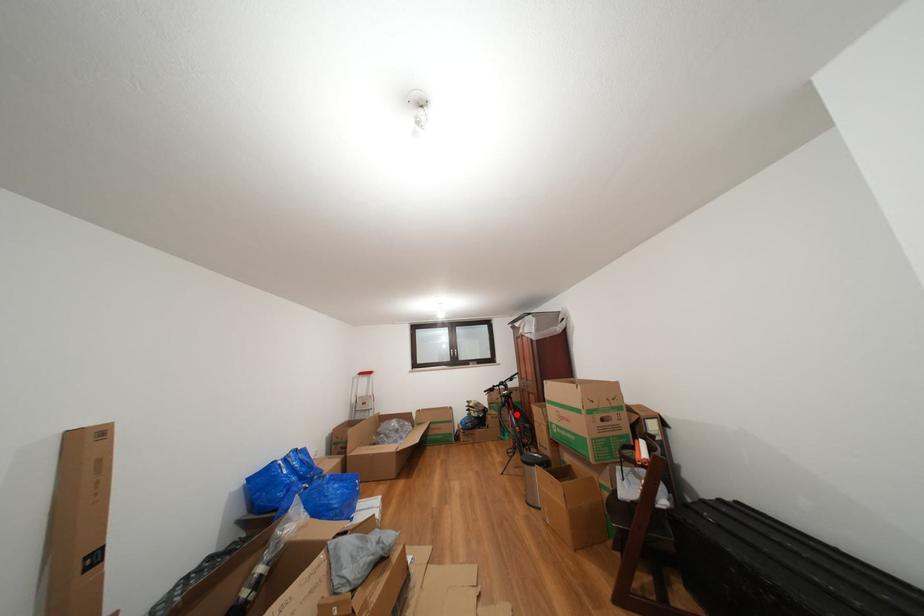
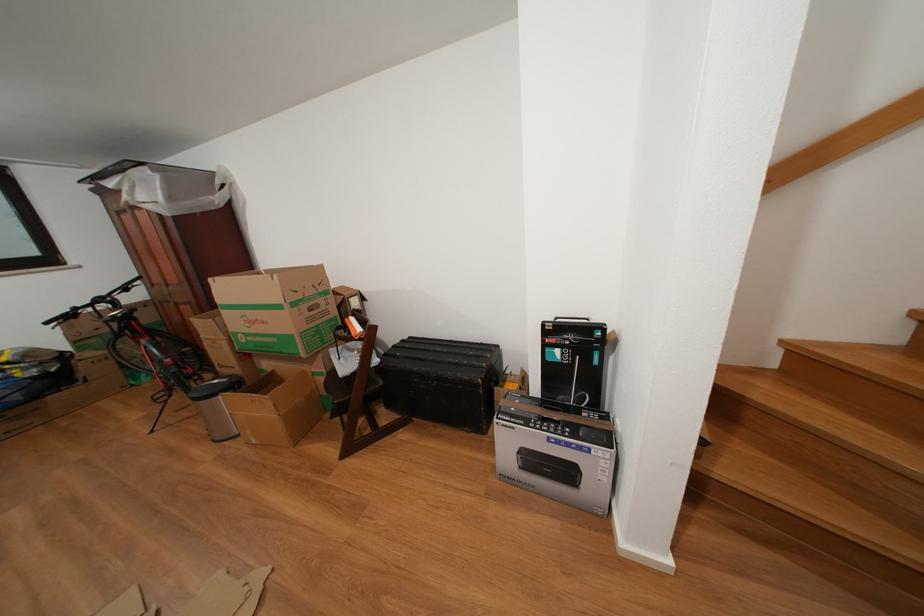
Question: I am providing you with two images of the same scene from different viewpoints. Given a red point in image1, look at the same physical point in image2. Is it:

Choices:
 (A) Closer to the viewpoint
 (B) Farther from the viewpoint

Answer: (A)